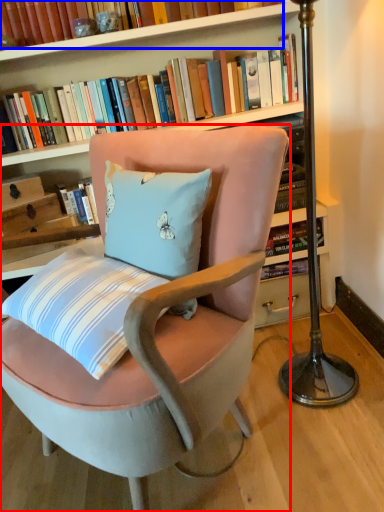
Question: Which object is closer to the camera taking this photo, chair (highlighted by a red box) or book (highlighted by a blue box)?

Choices:
 (A) chair
 (B) book

Answer: (A)